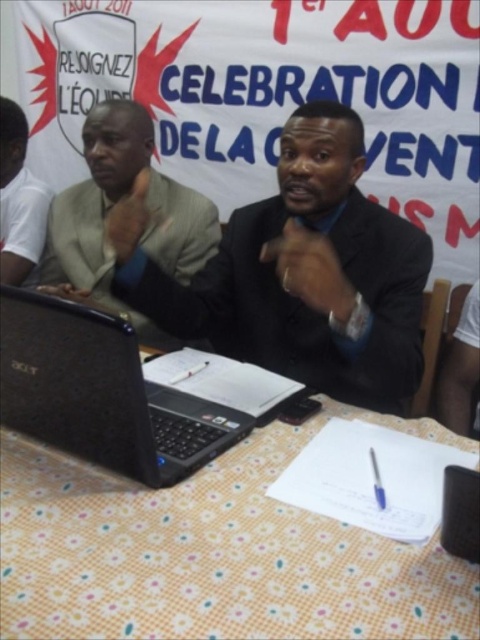
Question: Does light beige suit at center have a lesser width compared to blue glossy pen at center?

Choices:
 (A) no
 (B) yes

Answer: (A)

Question: Is yellow floral tablecloth at lower center above light beige suit at center?

Choices:
 (A) yes
 (B) no

Answer: (B)

Question: Which of the following is the closest to the observer?

Choices:
 (A) black matte laptop at center
 (B) light beige suit at center

Answer: (A)

Question: Can you confirm if black matte laptop at center is positioned to the right of blue glossy pen at center?

Choices:
 (A) yes
 (B) no

Answer: (B)

Question: Which object is farther from the camera taking this photo?

Choices:
 (A) light beige suit at center
 (B) blue glossy pen at center
 (C) black suit at center
 (D) white cotton shirt at left

Answer: (D)

Question: Which point is closer to the camera?

Choices:
 (A) black matte laptop at center
 (B) yellow floral tablecloth at lower center

Answer: (B)